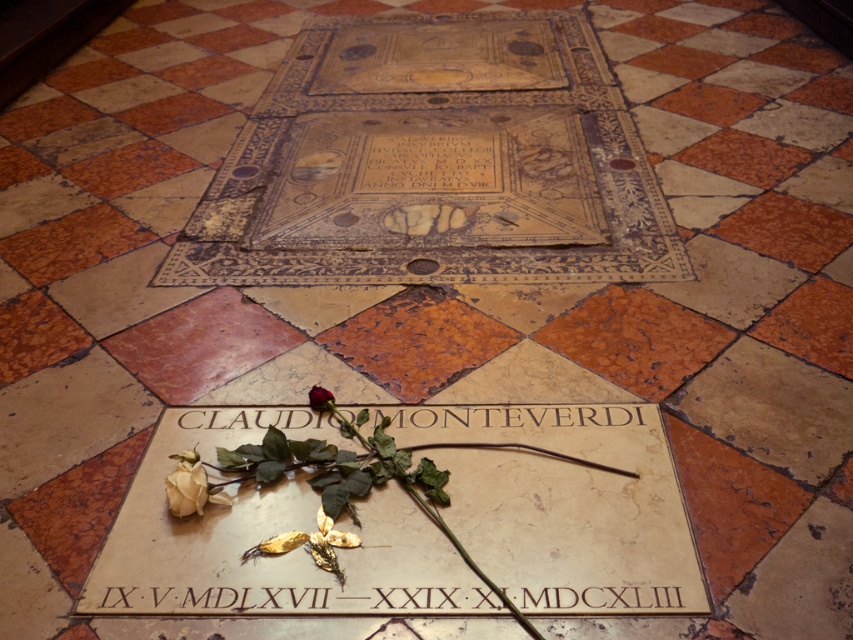
You are standing in front of the brass plaque at the center of the tile design. There are two points marked on the floor at coordinates point (200, 506) and point (317, 388). Which point is closer to you?

Point (200, 506) is closer to the viewer than point (317, 388).

You are standing in a room with the floor described above. You see a white matte rose at lower left and a deep red rose at center. Which rose is positioned more to the left?

The white matte rose at lower left is positioned more to the left than the deep red rose at center.